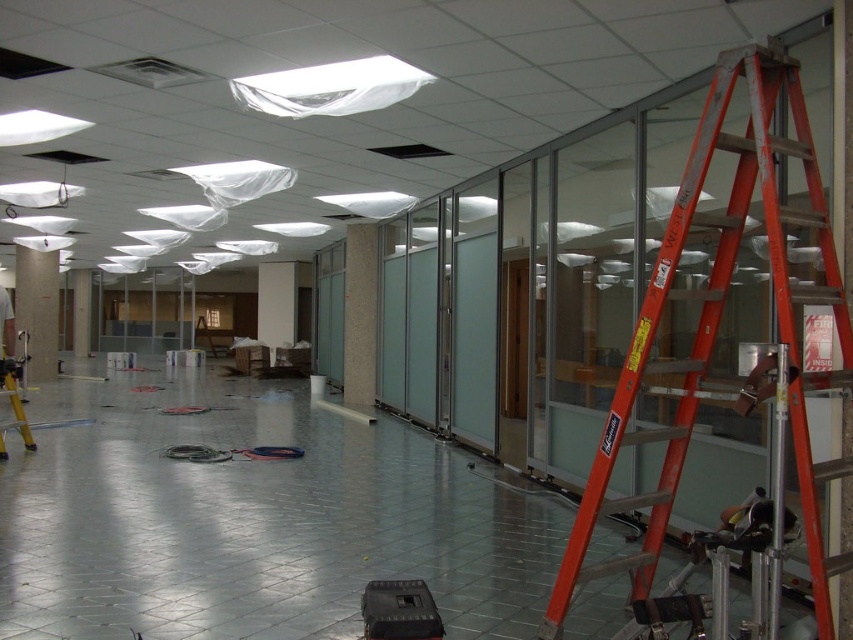
You are a contractor assessing the space. You need to determine if the clear glass partition at center can be moved to the left to make room for the black plastic equipment at center. Based on their sizes, is this feasible?

The clear glass partition at center is wider than the black plastic equipment at center. Therefore, moving the clear glass partition at center to the left might not be feasible since it occupies more space than the equipment, potentially limiting the available room.

You are standing in the construction area and need to reach a tool placed on the ceiling tiles. The orange metallic ladder at right and the clear glass partition at center are in your path. Which object should you move first to access the tool?

You should move the orange metallic ladder at right first because it is in front of the clear glass partition at center and blocking the path to the ceiling tiles.

You are a painter needing to reach the ceiling to apply a fresh coat of paint. You see an orange metallic ladder at right and a matte gray pillar at left. Which object can you use to safely reach the ceiling?

The orange metallic ladder at right is larger in size than the matte gray pillar at left, so you can use the orange metallic ladder at right to safely reach the ceiling.